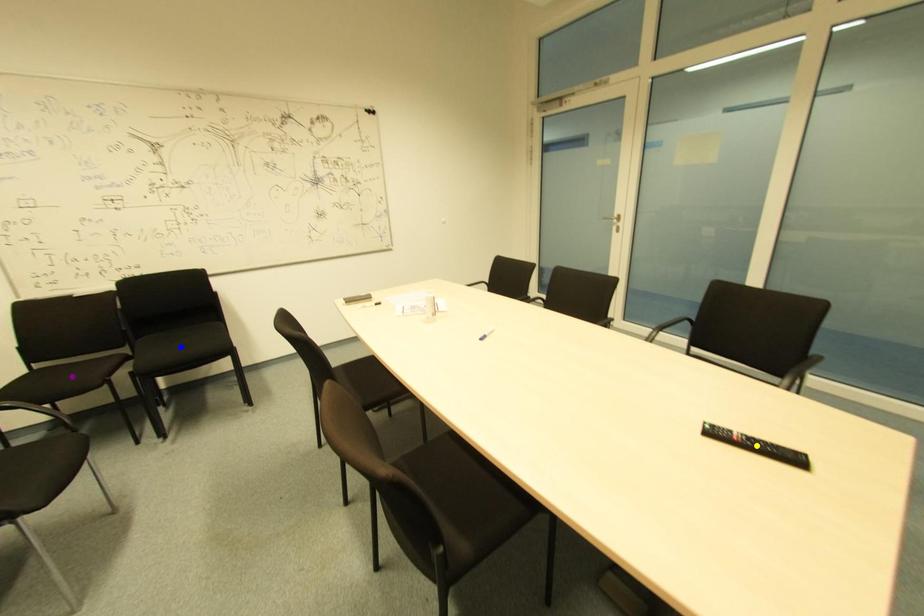
Order these from nearest to farthest:
purple point, yellow point, blue point

blue point
purple point
yellow point